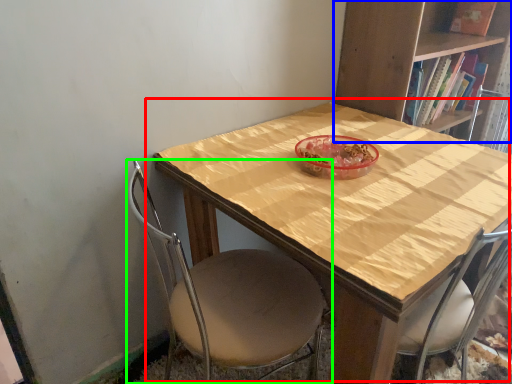
Question: Considering the real-world distances, which object is closest to table (highlighted by a red box)? bookcase (highlighted by a blue box) or chair (highlighted by a green box).

Choices:
 (A) bookcase
 (B) chair

Answer: (B)